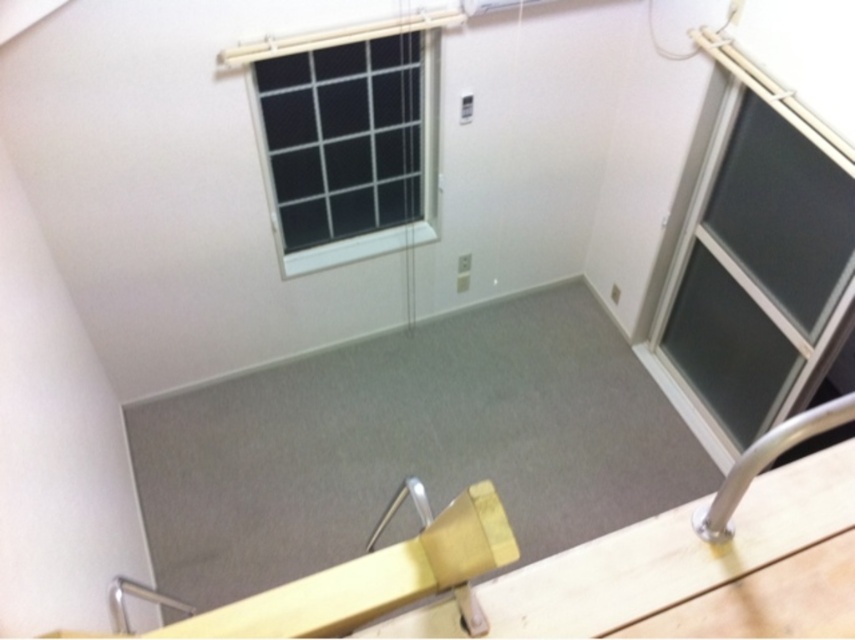
Is dark gray glass door at right bigger than black mesh window at upper center?

Indeed, dark gray glass door at right has a larger size compared to black mesh window at upper center.

What do you see at coordinates (758, 260) in the screenshot? The width and height of the screenshot is (855, 640). I see `dark gray glass door at right` at bounding box center [758, 260].

Find the location of a particular element. dark gray glass door at right is located at coordinates (758, 260).